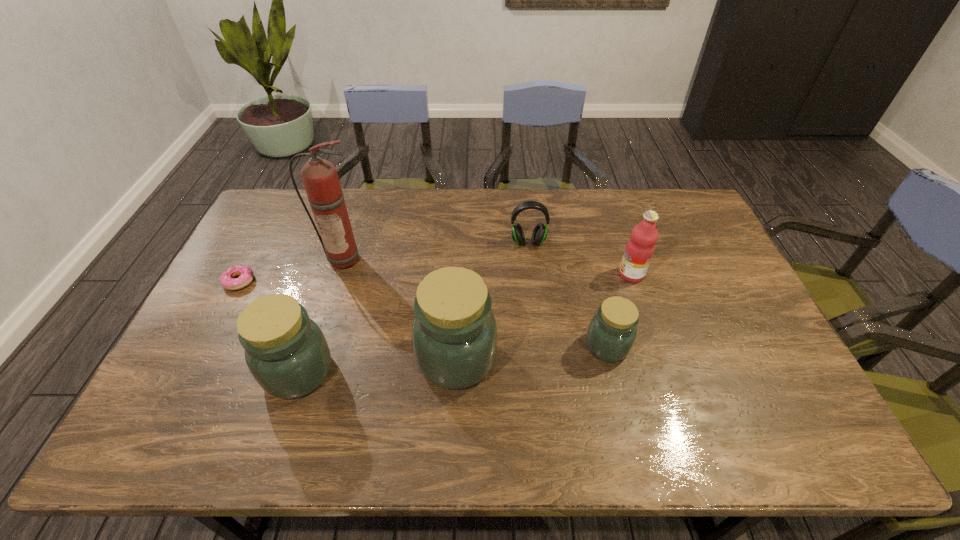
Where is `empty location between the fifth object from left to right and the leftmost jar`? empty location between the fifth object from left to right and the leftmost jar is located at coordinates (413, 307).

Locate an element on the screen. vacant space that's between the headset and the fourth object from left to right is located at coordinates (492, 300).

Identify the location of the fourth closest object to the fifth object from left to right. (319, 176).

Locate which object ranks fifth in proximity to the leftmost object. Please provide its 2D coordinates. Your answer should be formatted as a tuple, i.e. [(x, y)], where the tuple contains the x and y coordinates of a point satisfying the conditions above.

[(611, 334)]

Select which jar is the closest to the shortest object. Please provide its 2D coordinates. Your answer should be formatted as a tuple, i.e. [(x, y)], where the tuple contains the x and y coordinates of a point satisfying the conditions above.

[(286, 352)]

Locate an element on the screen. jar object that ranks as the second closest to the rightmost jar is located at coordinates (286, 352).

Where is `vacant space that satisfies the following two spatial constraints: 1. on the ear cups of the shortest jar; 2. on the right side of the headset`? The image size is (960, 540). vacant space that satisfies the following two spatial constraints: 1. on the ear cups of the shortest jar; 2. on the right side of the headset is located at coordinates (540, 346).

At what (x,y) coordinates should I click in order to perform the action: click on vacant region that satisfies the following two spatial constraints: 1. on the side of the fourth object from left to right with the label and nozzle; 2. on the right side of the tallest object. Please return your answer as a coordinate pair (x, y). This screenshot has height=540, width=960. Looking at the image, I should click on (314, 358).